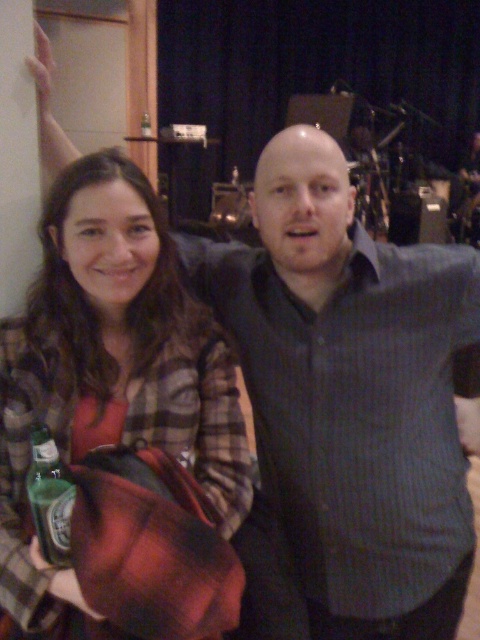
Question: Can you confirm if plaid flannel shirt at left is smaller than green glass bottle at lower left?

Choices:
 (A) yes
 (B) no

Answer: (B)

Question: Is plaid flannel shirt at left in front of green glass bottle at lower left?

Choices:
 (A) yes
 (B) no

Answer: (A)

Question: Which of the following is the closest to the observer?

Choices:
 (A) plaid flannel shirt at left
 (B) green glass bottle at lower left

Answer: (A)

Question: Is plaid flannel shirt at left below green glass bottle at lower left?

Choices:
 (A) no
 (B) yes

Answer: (A)